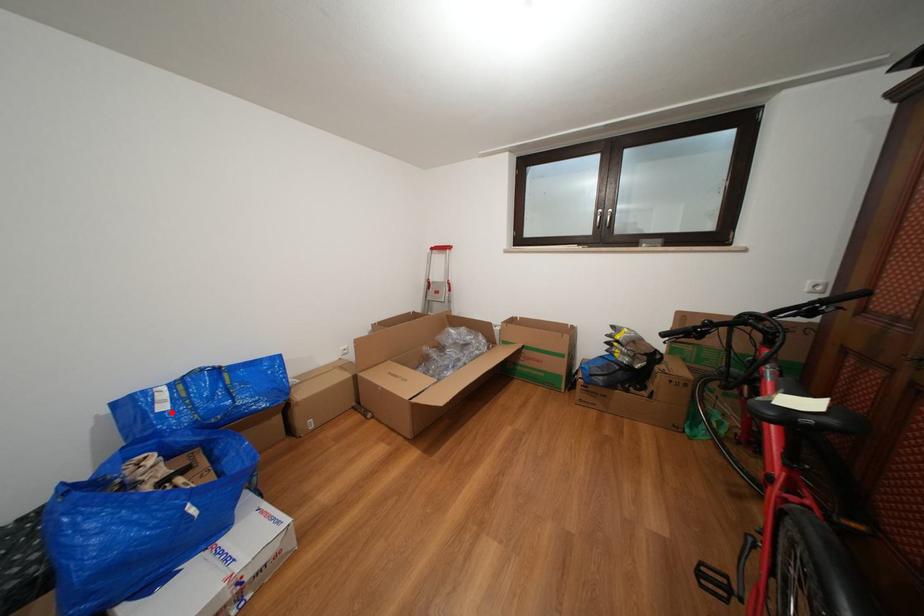
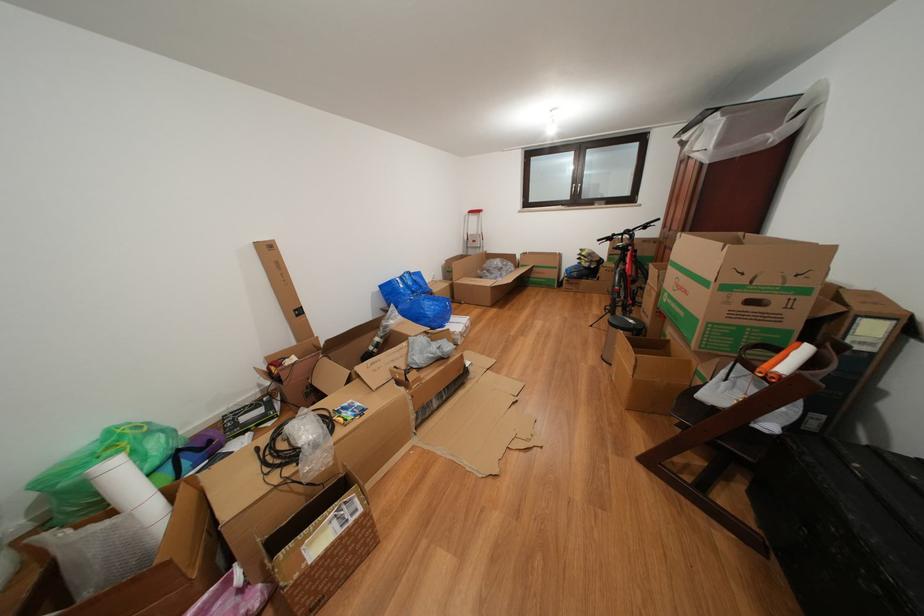
Question: I am providing you with two images of the same scene from different viewpoints. In image1, a red point is highlighted. Considering the same 3D point in image2, which of the following is correct?

Choices:
 (A) It is closer
 (B) It is farther

Answer: (A)